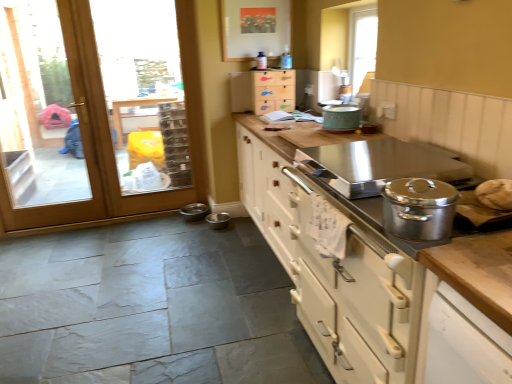
Identify the location of vacant area situated below metallic stainless steel bowls at lower center, the 1th appliance in the left-to-right sequence (from a real-world perspective). The image size is (512, 384). (196, 210).